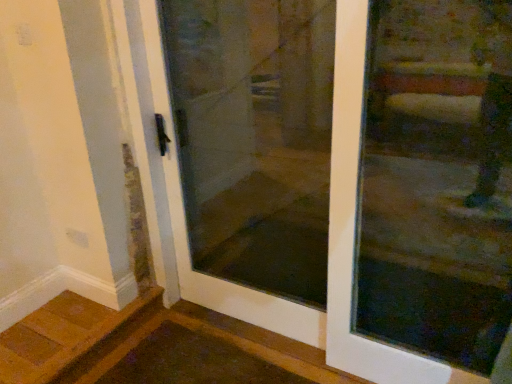
The width and height of the screenshot is (512, 384). In order to click on transparent glass door at center in this screenshot , I will do `click(251, 155)`.

What is the approximate width of transparent glass door at center?

It is 3.18 inches.

In order to face transparent glass door at center, should I rotate leftwards or rightwards?

Turn left by 2.178 degrees to look at transparent glass door at center.

What do you see at coordinates (251, 155) in the screenshot? I see `transparent glass door at center` at bounding box center [251, 155].

This screenshot has width=512, height=384. Describe the element at coordinates (421, 191) in the screenshot. I see `transparent glass door at center` at that location.

Image resolution: width=512 pixels, height=384 pixels. Identify the location of transparent glass door at center. (421, 191).

The width and height of the screenshot is (512, 384). Identify the location of transparent glass door at center. (251, 155).

Which is more to the left, transparent glass door at center or transparent glass door at center?

transparent glass door at center.

Considering the positions of objects transparent glass door at center and transparent glass door at center in the image provided, who is in front, transparent glass door at center or transparent glass door at center?

transparent glass door at center.

Is point (260, 29) closer or farther from the camera than point (351, 64)?

Point (260, 29) is positioned farther from the camera compared to point (351, 64).

From the image's perspective, is transparent glass door at center over transparent glass door at center?

Yes, from the image's perspective, transparent glass door at center is above transparent glass door at center.

From the picture: From a real-world perspective, which is physically below, transparent glass door at center or transparent glass door at center?

transparent glass door at center is physically lower.

Is transparent glass door at center wider than transparent glass door at center?

Correct, the width of transparent glass door at center exceeds that of transparent glass door at center.

Considering the sizes of objects transparent glass door at center and transparent glass door at center in the image provided, who is shorter, transparent glass door at center or transparent glass door at center?

transparent glass door at center is shorter.

Which of these two, transparent glass door at center or transparent glass door at center, is smaller?

transparent glass door at center.

Is transparent glass door at center inside or outside of transparent glass door at center?

transparent glass door at center is spatially situated outside transparent glass door at center.

Are transparent glass door at center and transparent glass door at center making contact?

There is a gap between transparent glass door at center and transparent glass door at center.

Is transparent glass door at center oriented towards transparent glass door at center?

No, transparent glass door at center is not aimed at transparent glass door at center.

Where is `elevator door behind the transparent glass door at center`? elevator door behind the transparent glass door at center is located at coordinates (251, 155).

Visually, is transparent glass door at center positioned to the left or to the right of transparent glass door at center?

Clearly, transparent glass door at center is on the right of transparent glass door at center in the image.

Which object is further away from the camera taking this photo, transparent glass door at center or transparent glass door at center?

transparent glass door at center is further away from the camera.

Is point (483, 253) in front of point (268, 144)?

Yes, point (483, 253) is in front of point (268, 144).

From the image's perspective, does transparent glass door at center appear higher than transparent glass door at center?

No.

From a real-world perspective, is transparent glass door at center located higher than transparent glass door at center?

No.

Consider the image. Between transparent glass door at center and transparent glass door at center, which one has smaller width?

transparent glass door at center is thinner.

Between transparent glass door at center and transparent glass door at center, which one has less height?

Standing shorter between the two is transparent glass door at center.

Does transparent glass door at center have a larger size compared to transparent glass door at center?

No.

Is transparent glass door at center completely or partially outside of transparent glass door at center?

Indeed, transparent glass door at center is completely outside transparent glass door at center.

Is transparent glass door at center directly adjacent to transparent glass door at center?

transparent glass door at center and transparent glass door at center are not in contact.

Does transparent glass door at center turn towards transparent glass door at center?

No, transparent glass door at center is not turned towards transparent glass door at center.

What's the angular difference between transparent glass door at center and transparent glass door at center's facing directions?

0.014 degrees separate the facing orientations of transparent glass door at center and transparent glass door at center.

You are a GUI agent. You are given a task and a screenshot of the screen. Output one action in this format:
    pyautogui.click(x=<x>, y=<y>)
    Task: Click on the door below the transparent glass door at center (from the image's perspective)
    The height and width of the screenshot is (384, 512).
    Given the screenshot: What is the action you would take?
    pyautogui.click(x=421, y=191)

I want to click on elevator door above the transparent glass door at center (from the image's perspective), so click(251, 155).

At what (x,y) coordinates should I click in order to perform the action: click on door located below the transparent glass door at center (from the image's perspective). Please return your answer as a coordinate pair (x, y). Looking at the image, I should click on (421, 191).